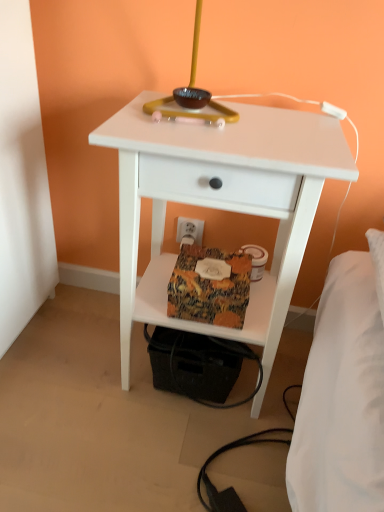
Where is `vacant area situated below matte yellow table lamp at upper center (from a real-world perspective)`? The height and width of the screenshot is (512, 384). vacant area situated below matte yellow table lamp at upper center (from a real-world perspective) is located at coordinates (191, 125).